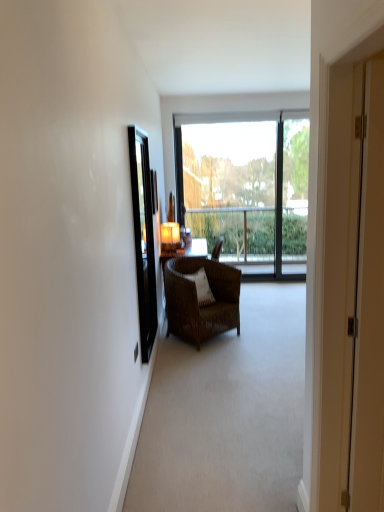
Question: Is the position of white textured pillow at center less distant than that of white wood screen door at right, which is the first screen door from right to left?

Choices:
 (A) no
 (B) yes

Answer: (A)

Question: Can you confirm if white textured pillow at center is positioned to the right of white wood screen door at right, the second screen door when ordered from back to front?

Choices:
 (A) yes
 (B) no

Answer: (B)

Question: Is white wood screen door at right, the 2th screen door in the left-to-right sequence, inside white textured pillow at center?

Choices:
 (A) yes
 (B) no

Answer: (B)

Question: From a real-world perspective, is white textured pillow at center beneath white wood screen door at right, the 2th screen door in the left-to-right sequence?

Choices:
 (A) no
 (B) yes

Answer: (B)

Question: Is white textured pillow at center oriented away from white wood screen door at right, the second screen door when ordered from back to front?

Choices:
 (A) yes
 (B) no

Answer: (B)

Question: Is white textured pillow at center taller than white wood screen door at right, the 2th screen door in the left-to-right sequence?

Choices:
 (A) yes
 (B) no

Answer: (B)

Question: Is transparent glass window at center touching matte glass lampshade at upper center?

Choices:
 (A) no
 (B) yes

Answer: (A)

Question: Does transparent glass window at center have a lesser width compared to matte glass lampshade at upper center?

Choices:
 (A) yes
 (B) no

Answer: (A)

Question: Would you say transparent glass window at center is outside matte glass lampshade at upper center?

Choices:
 (A) yes
 (B) no

Answer: (A)

Question: Is transparent glass window at center taller than matte glass lampshade at upper center?

Choices:
 (A) yes
 (B) no

Answer: (A)

Question: Can you confirm if transparent glass window at center is smaller than matte glass lampshade at upper center?

Choices:
 (A) no
 (B) yes

Answer: (A)

Question: Would you say matte glass lampshade at upper center is part of transparent glass window at center's contents?

Choices:
 (A) yes
 (B) no

Answer: (B)

Question: Is black glass screen door at left, the 2th screen door viewed from the right, wider than matte glass lampshade at upper center?

Choices:
 (A) yes
 (B) no

Answer: (B)